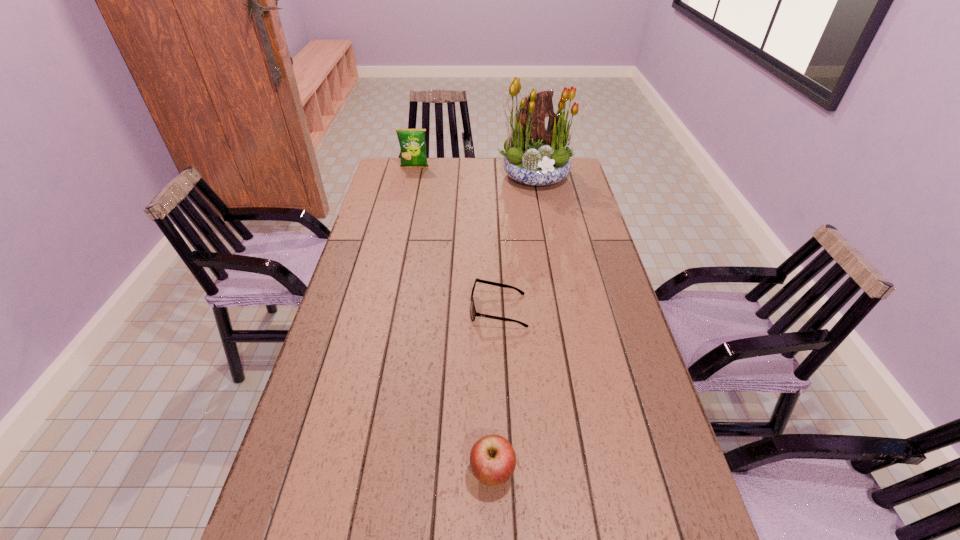
Find the location of a particular element. free space at the left edge is located at coordinates (387, 192).

Locate an element on the screen. The height and width of the screenshot is (540, 960). vacant space at the right edge of the desktop is located at coordinates (584, 234).

Identify the location of vacant space at the far left corner. (393, 181).

Image resolution: width=960 pixels, height=540 pixels. In order to click on unoccupied position between the crisp (potato chip) and the third tallest object in this screenshot , I will do `click(453, 320)`.

Where is `vacant space that is in between the flower arrangement and the shortest object`? This screenshot has width=960, height=540. vacant space that is in between the flower arrangement and the shortest object is located at coordinates (517, 243).

This screenshot has width=960, height=540. Find the location of `free space between the flower arrangement and the third shortest object`. free space between the flower arrangement and the third shortest object is located at coordinates (476, 172).

Where is `empty location between the nearest object and the crisp (potato chip)`? The height and width of the screenshot is (540, 960). empty location between the nearest object and the crisp (potato chip) is located at coordinates (453, 320).

Find the location of a particular element. The image size is (960, 540). empty space that is in between the sunglasses and the apple is located at coordinates (495, 392).

Locate an element on the screen. free space between the nearest object and the second tallest object is located at coordinates tap(453, 320).

Locate an element on the screen. vacant region between the third shortest object and the flower arrangement is located at coordinates 476,172.